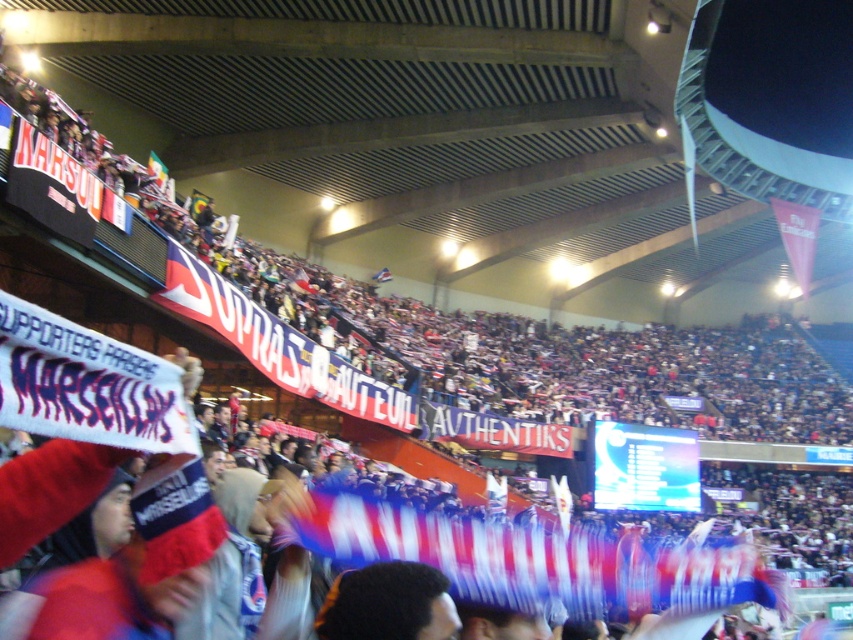
Question: Does blue and white fabric banner at center appear on the left side of blue fabric flag at center?

Choices:
 (A) no
 (B) yes

Answer: (A)

Question: Which object is closer to the camera taking this photo?

Choices:
 (A) blue and white fabric banner at center
 (B) blue fabric flag at center

Answer: (A)

Question: Is the position of blue and white fabric banner at center less distant than that of blue fabric flag at center?

Choices:
 (A) yes
 (B) no

Answer: (A)

Question: Which point is farther to the camera?

Choices:
 (A) blue fabric flag at center
 (B) blue and white fabric banner at center

Answer: (A)

Question: Among these objects, which one is farthest from the camera?

Choices:
 (A) blue and white fabric banner at center
 (B) blue fabric flag at center

Answer: (B)

Question: Is blue and white fabric banner at center smaller than blue fabric flag at center?

Choices:
 (A) yes
 (B) no

Answer: (B)